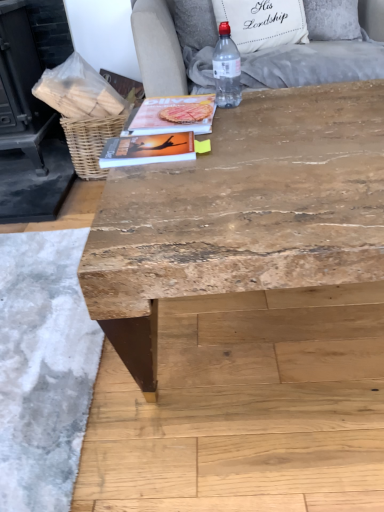
Identify the location of free space on the front side of matte orange book at center, the first magazine positioned from the bottom. (157, 186).